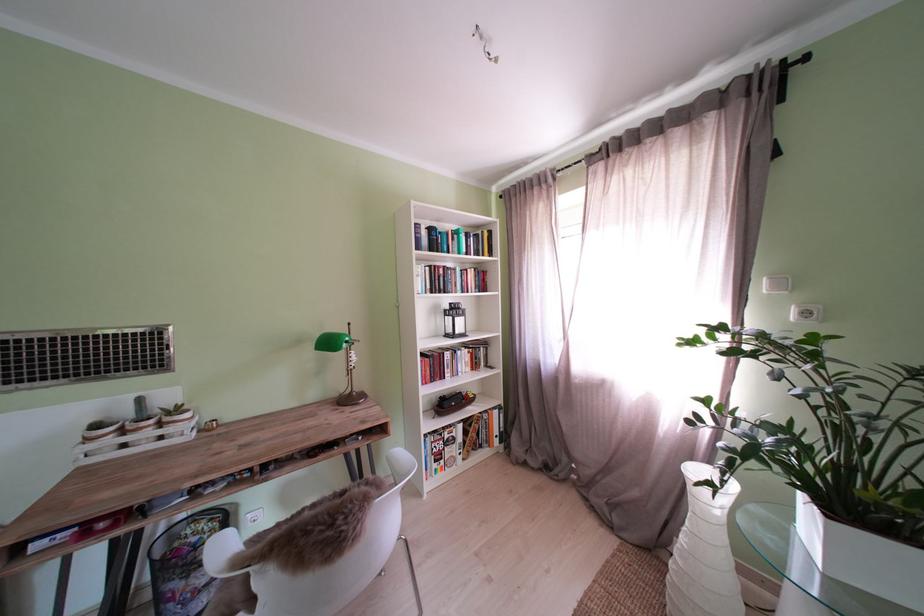
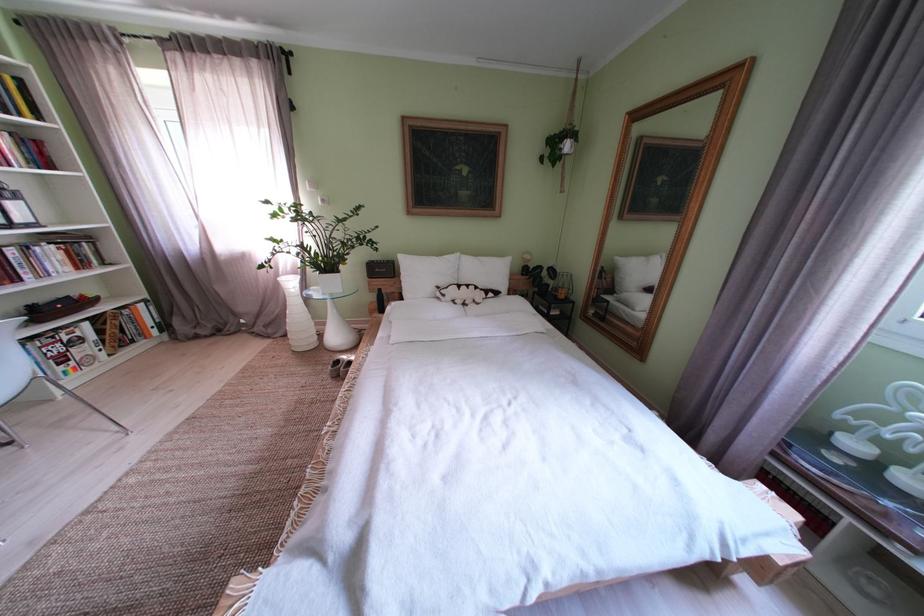
Locate, in the second image, the point that corresponds to point (469, 358) in the first image.

(49, 254)